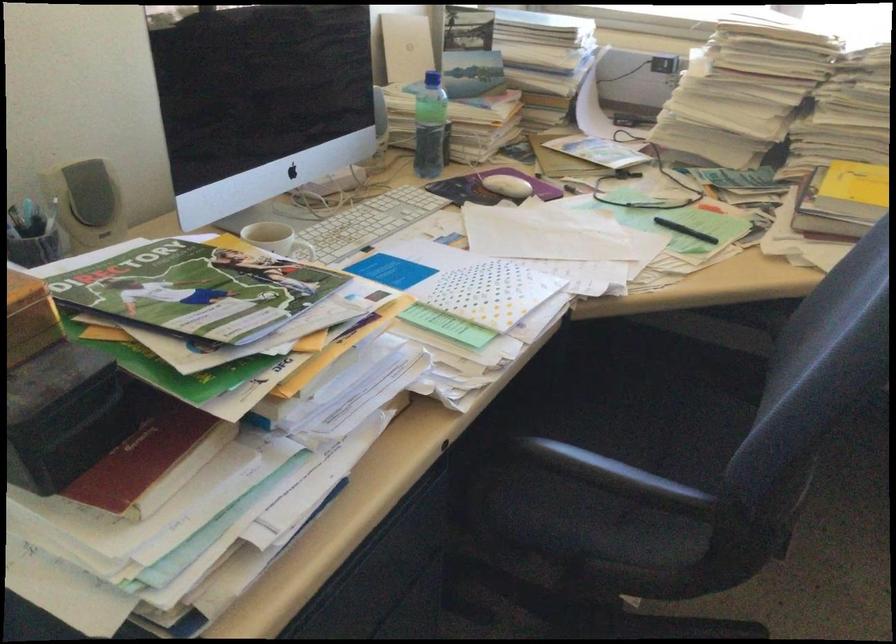
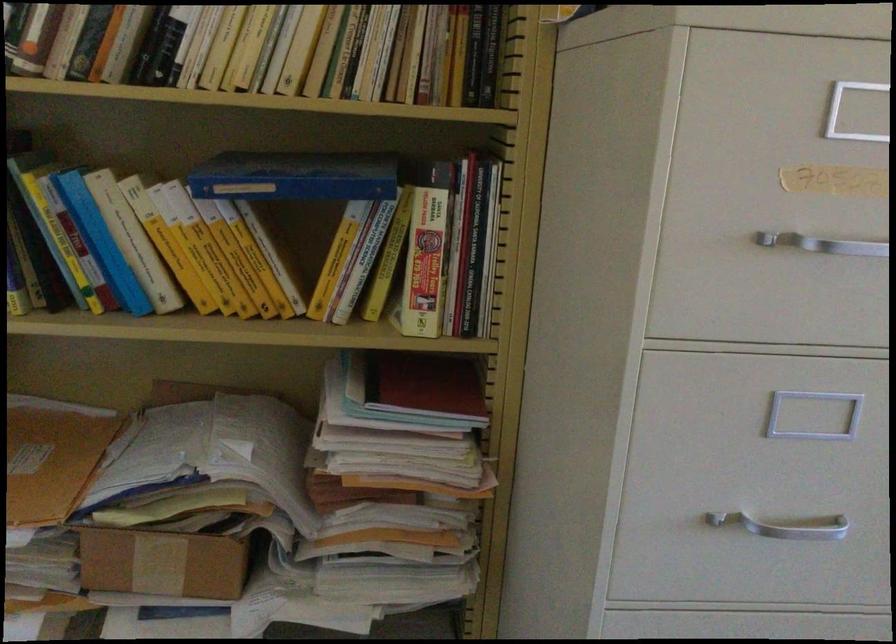
Question: The images are taken continuously from a first-person perspective. In which direction is your viewpoint rotating?

Choices:
 (A) Left
 (B) Right
 (C) Up
 (D) Down

Answer: (A)